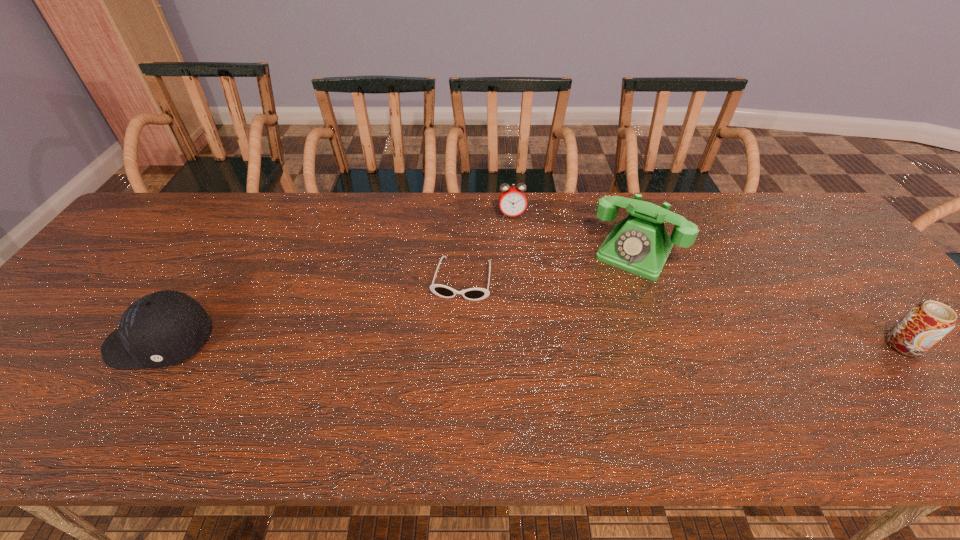
This screenshot has height=540, width=960. I want to click on the leftmost object, so click(161, 329).

In order to click on the rightmost object in this screenshot , I will do click(x=926, y=323).

You are a GUI agent. You are given a task and a screenshot of the screen. Output one action in this format:
    pyautogui.click(x=<x>, y=<y>)
    Task: Click on the fourth object from right to left
    The image size is (960, 540).
    Given the screenshot: What is the action you would take?
    pyautogui.click(x=474, y=294)

Image resolution: width=960 pixels, height=540 pixels. I want to click on the shortest object, so click(474, 294).

Locate an element on the screen. The height and width of the screenshot is (540, 960). the third object from right to left is located at coordinates (512, 200).

Where is `the farthest object`? The width and height of the screenshot is (960, 540). the farthest object is located at coordinates (512, 200).

Identify the location of the tallest object. (640, 244).

At what (x,y) coordinates should I click in order to perform the action: click on the fourth object from left to right. Please return your answer as a coordinate pair (x, y). Looking at the image, I should click on (640, 244).

The image size is (960, 540). In order to click on free spot located 0.170m at the front of the baseball cap where the brim is located in this screenshot , I will do [x=36, y=343].

At what (x,y) coordinates should I click in order to perform the action: click on free space located at the front of the baseball cap where the brim is located. Please return your answer as a coordinate pair (x, y). Looking at the image, I should click on (49, 343).